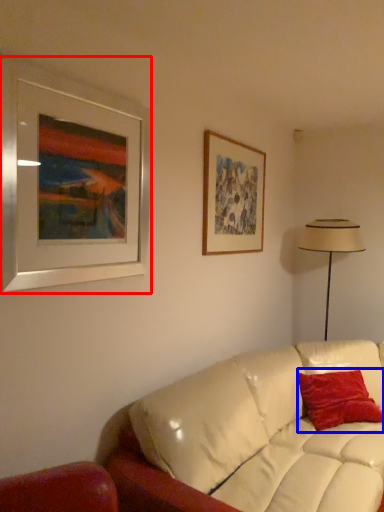
Question: Which object appears closest to the camera in this image, picture frame (highlighted by a red box) or pillow (highlighted by a blue box)?

Choices:
 (A) picture frame
 (B) pillow

Answer: (A)